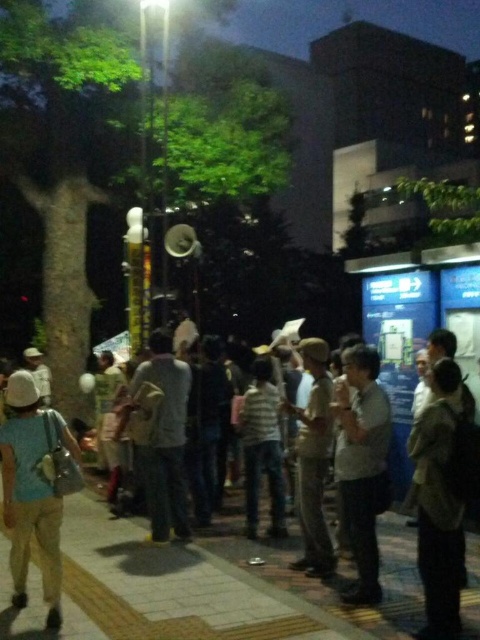
Question: Observing the image, what is the correct spatial positioning of dark brown leather jacket at lower right in reference to light blue fabric shirt at lower left?

Choices:
 (A) below
 (B) above

Answer: (B)

Question: Does dark clothing crowd at center lie behind khaki fabric pants at center?

Choices:
 (A) yes
 (B) no

Answer: (B)

Question: Which point is closer to the camera?

Choices:
 (A) (118, 580)
 (B) (7, 438)

Answer: (B)

Question: Which point is closer to the camera?

Choices:
 (A) striped fabric shirt at center
 (B) dark brown leather jacket at lower right
 (C) dark clothing crowd at center
 (D) light gray shirt at center

Answer: (B)

Question: Which object is the closest to the khaki fabric pants at center?

Choices:
 (A) dark clothing crowd at center
 (B) light brown fabric jacket at center
 (C) light blue fabric shirt at lower left

Answer: (A)

Question: Is light gray shirt at center bigger than light brown fabric jacket at center?

Choices:
 (A) yes
 (B) no

Answer: (B)